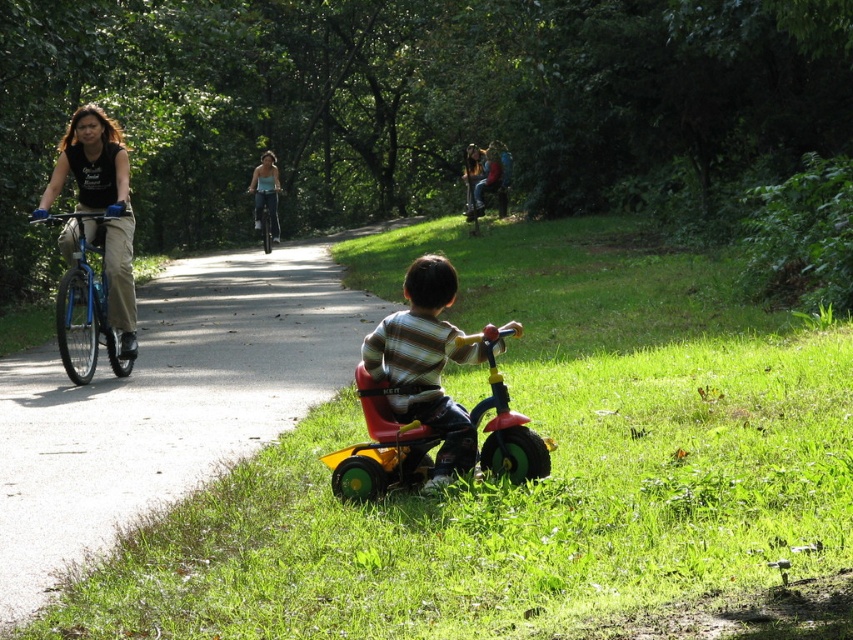
Is blue metallic bicycle at left shorter than blue metallic bicycle at center?

No, blue metallic bicycle at left is not shorter than blue metallic bicycle at center.

Can you confirm if blue metallic bicycle at left is smaller than blue metallic bicycle at center?

Incorrect, blue metallic bicycle at left is not smaller in size than blue metallic bicycle at center.

Who is more forward, (73, 285) or (276, 228)?

Point (73, 285) is more forward.

Where is `blue metallic bicycle at left`? This screenshot has width=853, height=640. blue metallic bicycle at left is located at coordinates (86, 300).

Is yellow plastic tricycle at lower center wider than matte plastic tricycle at lower center?

Correct, the width of yellow plastic tricycle at lower center exceeds that of matte plastic tricycle at lower center.

Does yellow plastic tricycle at lower center have a larger size compared to matte plastic tricycle at lower center?

Yes, yellow plastic tricycle at lower center is bigger than matte plastic tricycle at lower center.

Identify the location of yellow plastic tricycle at lower center. (167, 401).

Does matte plastic tricycle at lower center appear under blue metallic bicycle at left?

Correct, matte plastic tricycle at lower center is located below blue metallic bicycle at left.

Who is more forward, (x=410, y=312) or (x=74, y=269)?

Point (x=410, y=312) is more forward.

Looking at this image, who is more distant from viewer, (451, 356) or (71, 317)?

Positioned behind is point (71, 317).

You are a GUI agent. You are given a task and a screenshot of the screen. Output one action in this format:
    pyautogui.click(x=<x>, y=<y>)
    Task: Click on the matte plastic tricycle at lower center
    
    Given the screenshot: What is the action you would take?
    pyautogui.click(x=426, y=362)